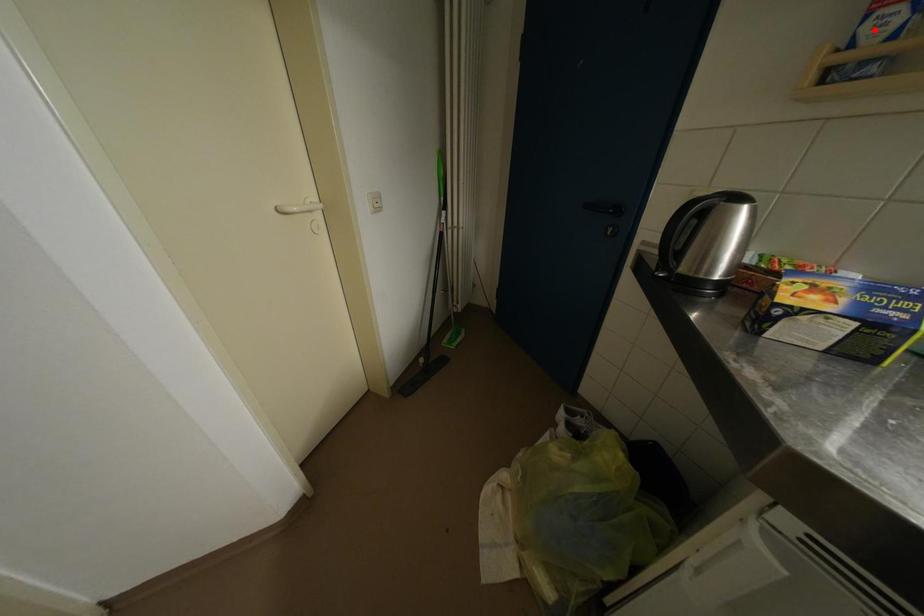
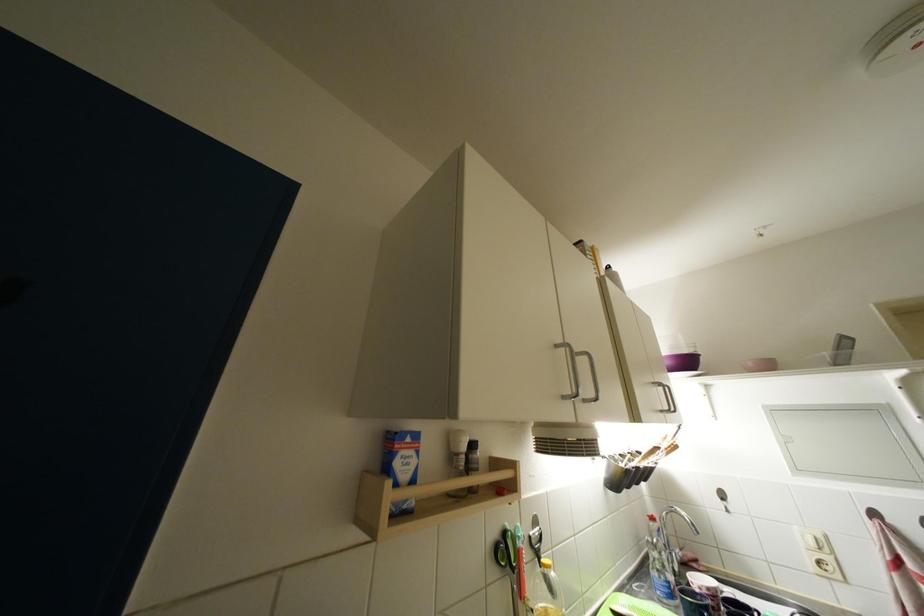
Where in the second image is the point corresponding to the highlighted location from the first image?

(404, 467)